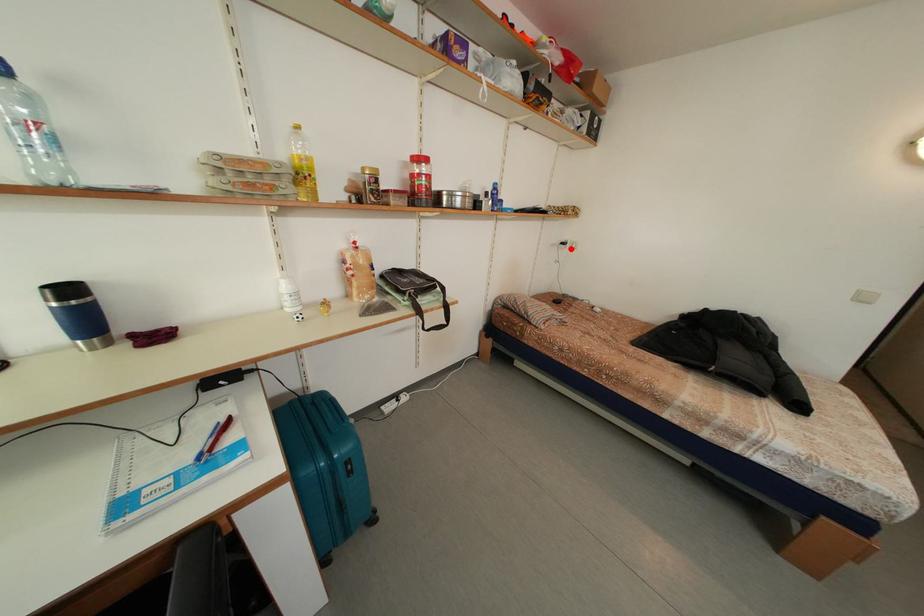
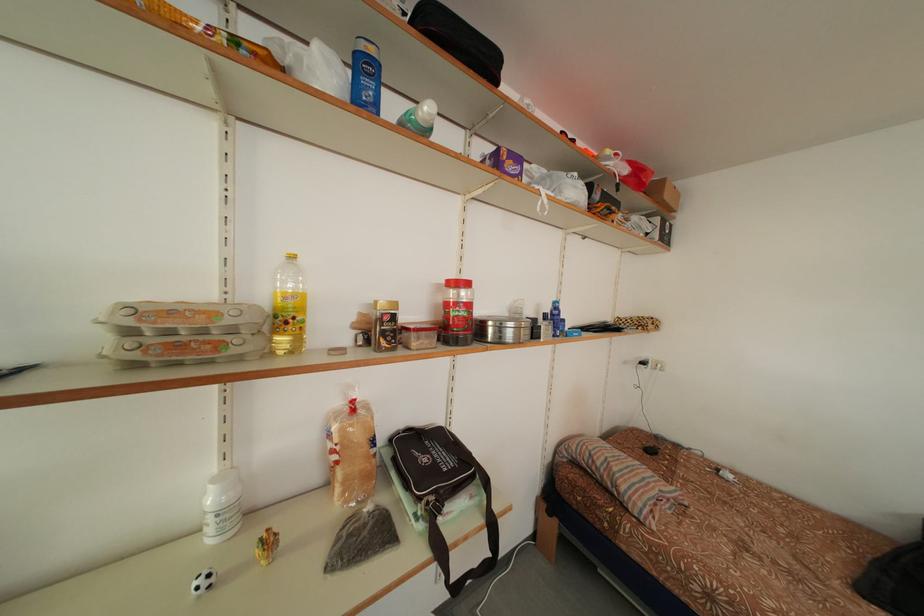
Find the pixel in the second image that matches the highlighted location in the first image.

(650, 369)